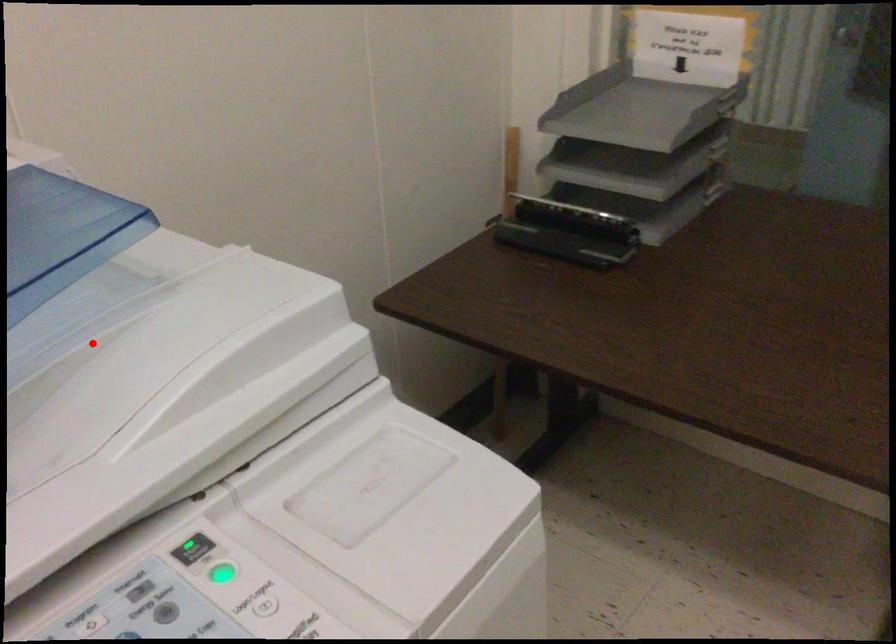
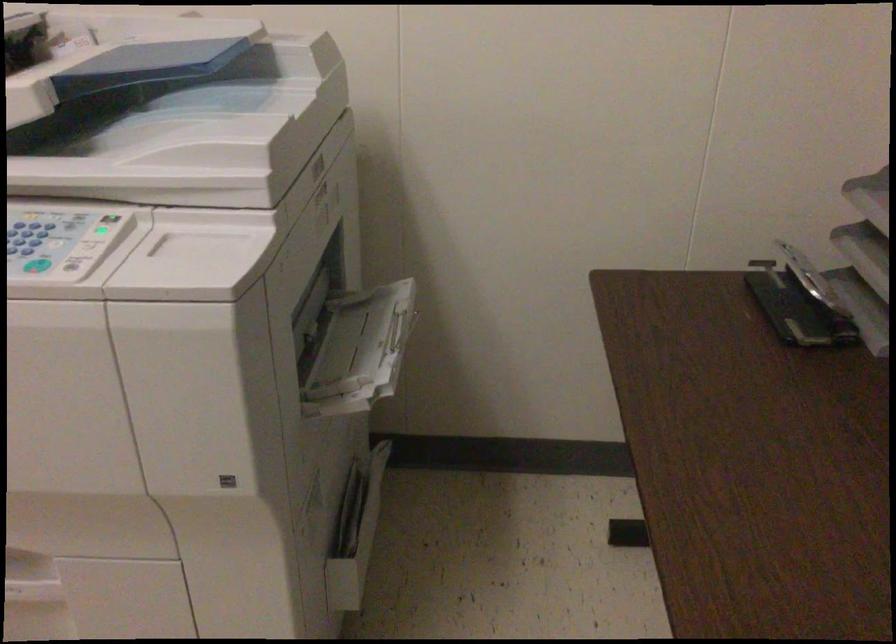
In the second image, find the point that corresponds to the highlighted location in the first image.

(173, 126)